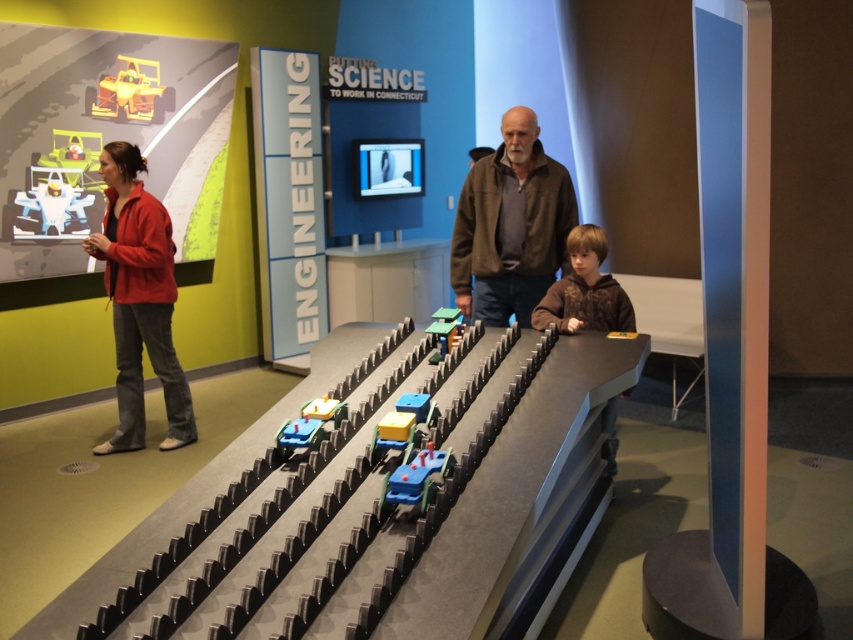
Based on the photo, can you confirm if wooden toy train at center is bigger than yellow plastic toy car at upper left?

Yes.

Is point (258, 547) farther from camera compared to point (122, 80)?

No.

Describe the element at coordinates (404, 513) in the screenshot. I see `wooden toy train at center` at that location.

Where is `wooden toy train at center`? The height and width of the screenshot is (640, 853). wooden toy train at center is located at coordinates (404, 513).

Who is taller, matte red jacket at left or yellow plastic toy car at upper left?

matte red jacket at left

Can you confirm if matte red jacket at left is wider than yellow plastic toy car at upper left?

Yes.

Locate an element on the screen. This screenshot has height=640, width=853. matte red jacket at left is located at coordinates [138, 300].

Is point (503, 314) less distant than point (99, 163)?

Yes.

Locate an element on the screen. brown suede jacket at center is located at coordinates (509, 225).